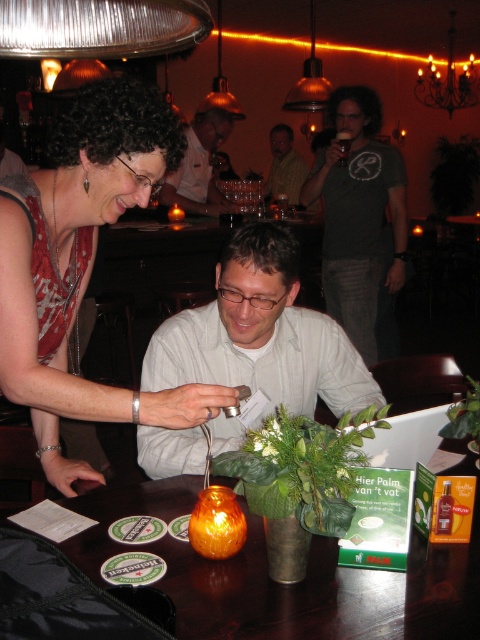
Can you confirm if matte white shirt at center is positioned below metallic gold pendant light at upper center?

Yes, matte white shirt at center is below metallic gold pendant light at upper center.

Does point (177, 177) come farther from viewer compared to point (231, 113)?

No, (177, 177) is closer to viewer.

The width and height of the screenshot is (480, 640). What are the coordinates of `matte white shirt at center` in the screenshot? It's located at (200, 168).

Which is more to the left, translucent orange glass vase at center or dark gray t-shirt at upper center?

translucent orange glass vase at center is more to the left.

Measure the distance between translucent orange glass vase at center and dark gray t-shirt at upper center.

translucent orange glass vase at center and dark gray t-shirt at upper center are 7.43 feet apart.

This screenshot has height=640, width=480. I want to click on translucent orange glass vase at center, so click(287, 584).

From the picture: Is translucent orange glass vase at center further to the viewer compared to matte white shirt at center?

No, translucent orange glass vase at center is closer to the viewer.

Can you confirm if translucent orange glass vase at center is positioned to the right of matte white shirt at center?

Indeed, translucent orange glass vase at center is positioned on the right side of matte white shirt at center.

I want to click on translucent orange glass vase at center, so click(x=287, y=584).

Find the location of a particular element. The height and width of the screenshot is (640, 480). translucent orange glass vase at center is located at coordinates (287, 584).